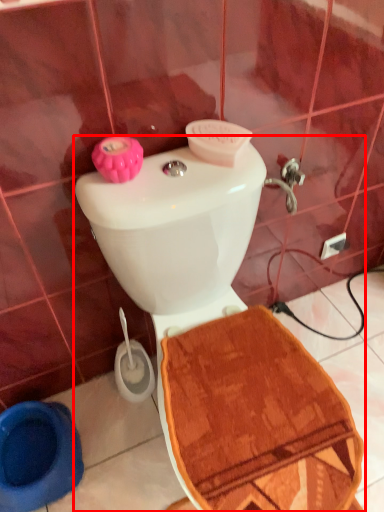
Question: From the image's perspective, what is the correct spatial relationship of toilet (annotated by the red box) in relation to toilet bowl?

Choices:
 (A) above
 (B) below

Answer: (A)